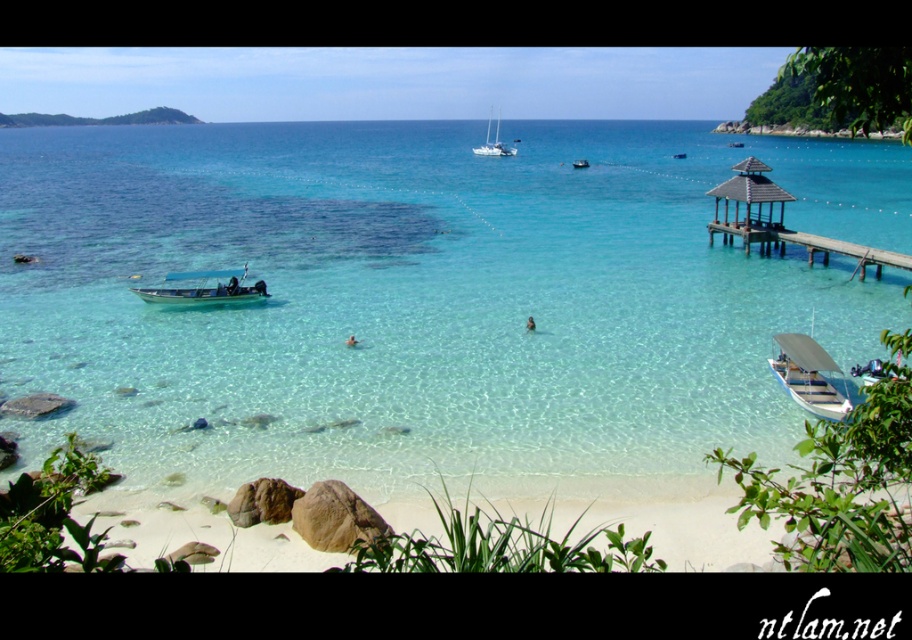
You are a swimmer who wants to reach the white glossy sailboat at upper center from the metallic blue boat at lower left. Considering their widths, which boat is narrower and easier to maneuver around?

The metallic blue boat at lower left is thinner than the white glossy sailboat at upper center, so it is narrower and easier to maneuver around.